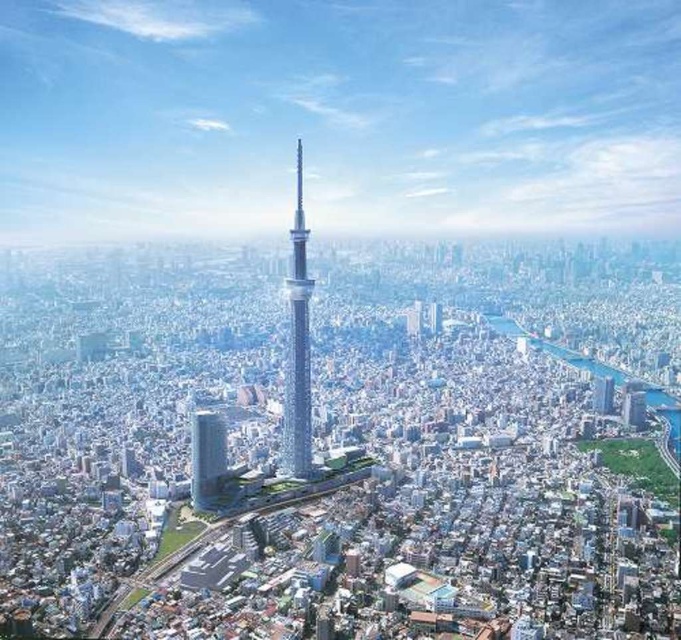
Which is above, sleek glass tower at center or smooth glass skyscraper at center?

sleek glass tower at center is above.

Is sleek glass tower at center positioned before smooth glass skyscraper at center?

Yes, sleek glass tower at center is in front of smooth glass skyscraper at center.

The height and width of the screenshot is (640, 681). What are the coordinates of `sleek glass tower at center` in the screenshot? It's located at (298, 346).